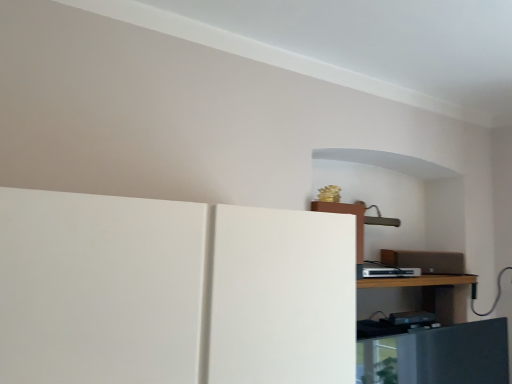
Locate an element on the screen. brown wooden shelf at center is located at coordinates click(x=418, y=281).

Image resolution: width=512 pixels, height=384 pixels. What do you see at coordinates (418, 281) in the screenshot? I see `brown wooden shelf at center` at bounding box center [418, 281].

Describe the element at coordinates (388, 271) in the screenshot. I see `silver metallic cable box at upper right` at that location.

Where is `silver metallic cable box at upper right`? This screenshot has height=384, width=512. silver metallic cable box at upper right is located at coordinates (388, 271).

Locate an element on the screen. brown wooden shelf at center is located at coordinates (418, 281).

Does brown wooden shelf at center appear on the right side of silver metallic cable box at upper right?

Yes, brown wooden shelf at center is to the right of silver metallic cable box at upper right.

Considering the relative positions of brown wooden shelf at center and silver metallic cable box at upper right in the image provided, is brown wooden shelf at center behind silver metallic cable box at upper right?

No, brown wooden shelf at center is closer to the viewer.

Is point (399, 286) in front of point (408, 276)?

No, (399, 286) is behind (408, 276).

From the image's perspective, does brown wooden shelf at center appear higher than silver metallic cable box at upper right?

No, from the image's perspective, brown wooden shelf at center is not over silver metallic cable box at upper right.

From a real-world perspective, is brown wooden shelf at center over silver metallic cable box at upper right?

No, from a real-world perspective, brown wooden shelf at center is not on top of silver metallic cable box at upper right.

Which of these two, brown wooden shelf at center or silver metallic cable box at upper right, is wider?

Wider between the two is brown wooden shelf at center.

Who is taller, brown wooden shelf at center or silver metallic cable box at upper right?

With more height is silver metallic cable box at upper right.

Between brown wooden shelf at center and silver metallic cable box at upper right, which one has larger size?

brown wooden shelf at center.

Is silver metallic cable box at upper right completely or partially inside brown wooden shelf at center?

No.

Is brown wooden shelf at center directly adjacent to silver metallic cable box at upper right?

No, brown wooden shelf at center is not in contact with silver metallic cable box at upper right.

Is brown wooden shelf at center positioned with its back to silver metallic cable box at upper right?

No.

In the scene shown: How different are the orientations of brown wooden shelf at center and silver metallic cable box at upper right in degrees?

The angular difference between brown wooden shelf at center and silver metallic cable box at upper right is 2.7 degrees.

How much distance is there between brown wooden shelf at center and silver metallic cable box at upper right?

A distance of 4.46 inches exists between brown wooden shelf at center and silver metallic cable box at upper right.

At what (x,y) coordinates should I click in order to perform the action: click on table in front of the silver metallic cable box at upper right. Please return your answer as a coordinate pair (x, y). The height and width of the screenshot is (384, 512). Looking at the image, I should click on (418, 281).

Based on their positions, is silver metallic cable box at upper right located to the left or right of brown wooden shelf at center?

In the image, silver metallic cable box at upper right appears on the left side of brown wooden shelf at center.

Does silver metallic cable box at upper right come in front of brown wooden shelf at center?

No.

Is point (381, 267) positioned after point (406, 285)?

Yes, it is.

From the image's perspective, between silver metallic cable box at upper right and brown wooden shelf at center, which one is located above?

silver metallic cable box at upper right, from the image's perspective.

From a real-world perspective, which is physically below, silver metallic cable box at upper right or brown wooden shelf at center?

brown wooden shelf at center, from a real-world perspective.

Considering the relative sizes of silver metallic cable box at upper right and brown wooden shelf at center in the image provided, is silver metallic cable box at upper right wider than brown wooden shelf at center?

No.

Can you confirm if silver metallic cable box at upper right is shorter than brown wooden shelf at center?

No, silver metallic cable box at upper right is not shorter than brown wooden shelf at center.

In terms of size, does silver metallic cable box at upper right appear bigger or smaller than brown wooden shelf at center?

silver metallic cable box at upper right is smaller than brown wooden shelf at center.

Is silver metallic cable box at upper right located outside brown wooden shelf at center?

silver metallic cable box at upper right is positioned outside brown wooden shelf at center.

Is silver metallic cable box at upper right touching brown wooden shelf at center?

No, silver metallic cable box at upper right is not touching brown wooden shelf at center.

Could you tell me if silver metallic cable box at upper right is facing brown wooden shelf at center?

No, silver metallic cable box at upper right is not oriented towards brown wooden shelf at center.

What's the angular difference between silver metallic cable box at upper right and brown wooden shelf at center's facing directions?

2.7 degrees separate the facing orientations of silver metallic cable box at upper right and brown wooden shelf at center.

Image resolution: width=512 pixels, height=384 pixels. There is a brown wooden shelf at center. In order to click on appliance above it (from a real-world perspective) in this screenshot , I will do `click(388, 271)`.

Image resolution: width=512 pixels, height=384 pixels. Find the location of `table lying in front of the silver metallic cable box at upper right`. table lying in front of the silver metallic cable box at upper right is located at coordinates (418, 281).

You are a GUI agent. You are given a task and a screenshot of the screen. Output one action in this format:
    pyautogui.click(x=<x>, y=<y>)
    Task: Click on the appliance behind the brown wooden shelf at center
    
    Given the screenshot: What is the action you would take?
    pyautogui.click(x=388, y=271)